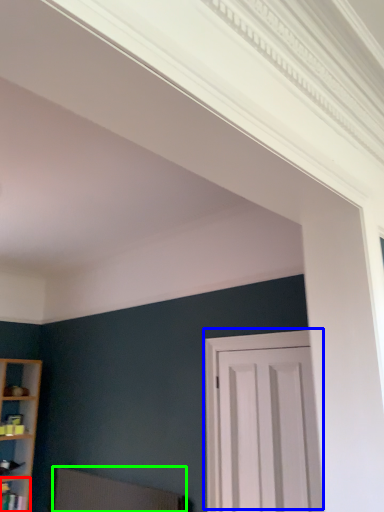
Question: Estimate the real-world distances between objects in this image. Which object is closer to shelf (highlighted by a red box), door (highlighted by a blue box) or swivel chair (highlighted by a green box)?

Choices:
 (A) door
 (B) swivel chair

Answer: (B)